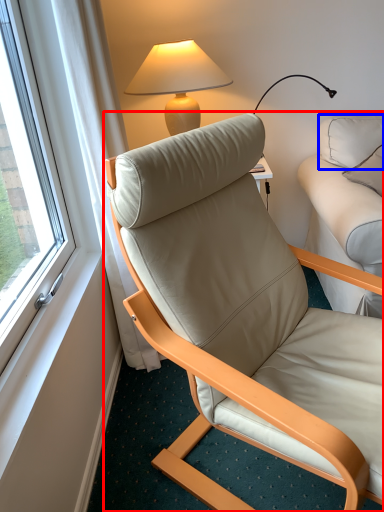
Question: Among these objects, which one is farthest to the camera, chair (highlighted by a red box) or pillow (highlighted by a blue box)?

Choices:
 (A) chair
 (B) pillow

Answer: (B)